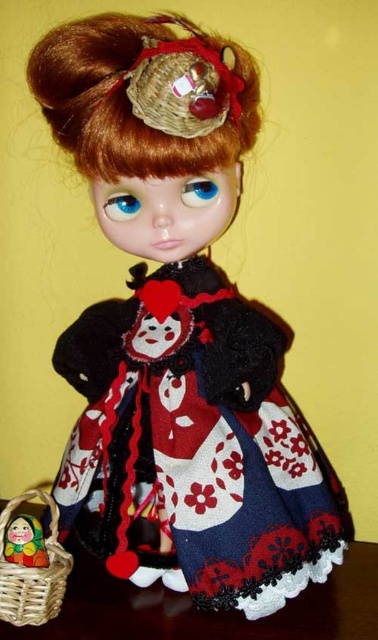
Question: Does woven brown basket at lower left appear on the left side of matte yellow basket at lower left?

Choices:
 (A) no
 (B) yes

Answer: (A)

Question: Is wooden table at lower left wider than matte yellow basket at lower left?

Choices:
 (A) yes
 (B) no

Answer: (A)

Question: Which of the following is the farthest from the observer?

Choices:
 (A) woven brown basket at lower left
 (B) matte yellow basket at lower left

Answer: (B)

Question: Estimate the real-world distances between objects in this image. Which object is farther from the wooden table at lower left?

Choices:
 (A) matte yellow basket at lower left
 (B) woven brown basket at lower left

Answer: (A)

Question: Is woven brown basket at lower left smaller than matte yellow basket at lower left?

Choices:
 (A) no
 (B) yes

Answer: (A)

Question: Which of the following is the farthest from the observer?

Choices:
 (A) (55, 506)
 (B) (26, 515)

Answer: (B)